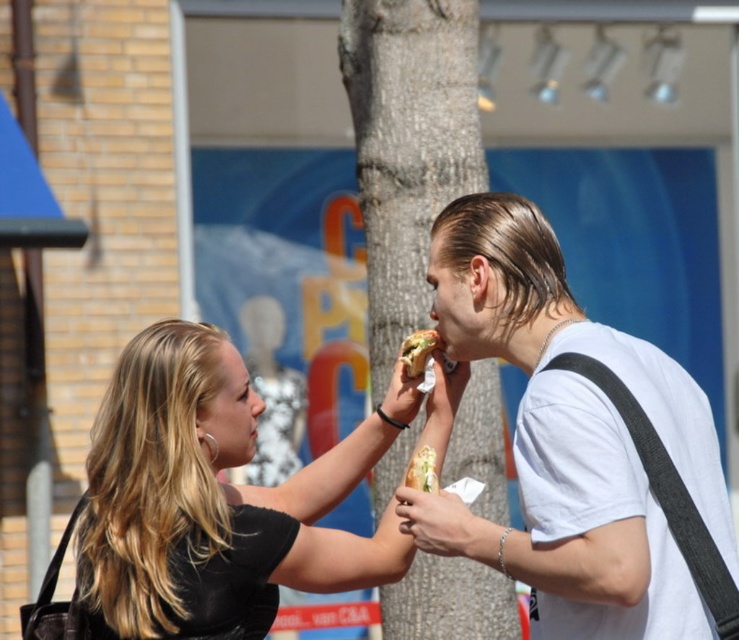
You are a photographer trying to capture a closeup of the green textured tree trunk at center and the smooth white hand at center. Which object should you zoom in on to ensure it takes up more space in your photo?

The green textured tree trunk at center has a larger width than the smooth white hand at center, so zooming in on the tree trunk will make it take up more space in the photo.

You are standing at the origin point in the image and want to move towards the two points labeled as point (412, 515) and point (403, 477). Which point should you aim for first if you want to reach the closer one?

Point (412, 515) is in front of point (403, 477), so you should aim for point (412, 515) first as it is closer to you.

You are a photographer trying to capture the interaction between the two people in the scene. Since you want to focus on their hands and the tree trunk, you need to ensure that the green textured tree trunk at center is large enough to be noticeable compared to the smooth white hand at center. Based on the description, will the tree trunk be more prominent in the photo?

The green textured tree trunk at center is bigger than the smooth white hand at center, so yes, the tree trunk will be more prominent in the photo.